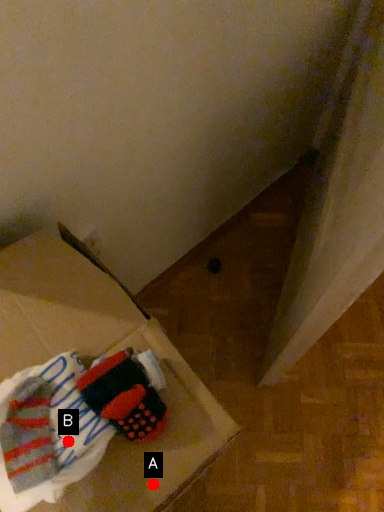
Question: Two points are circled on the image, labeled by A and B beside each circle. Which of the following is the closest to the observer?

Choices:
 (A) A is closer
 (B) B is closer

Answer: (B)